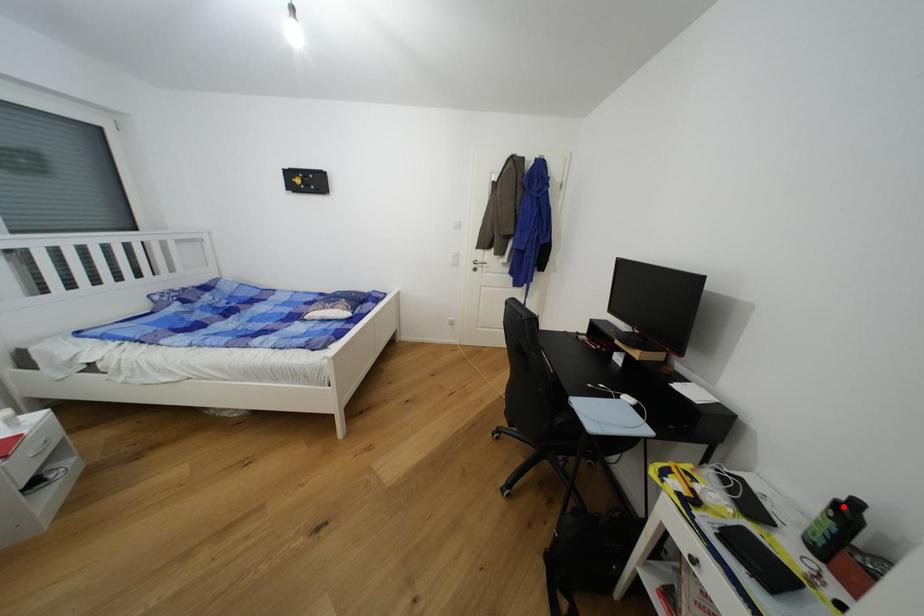
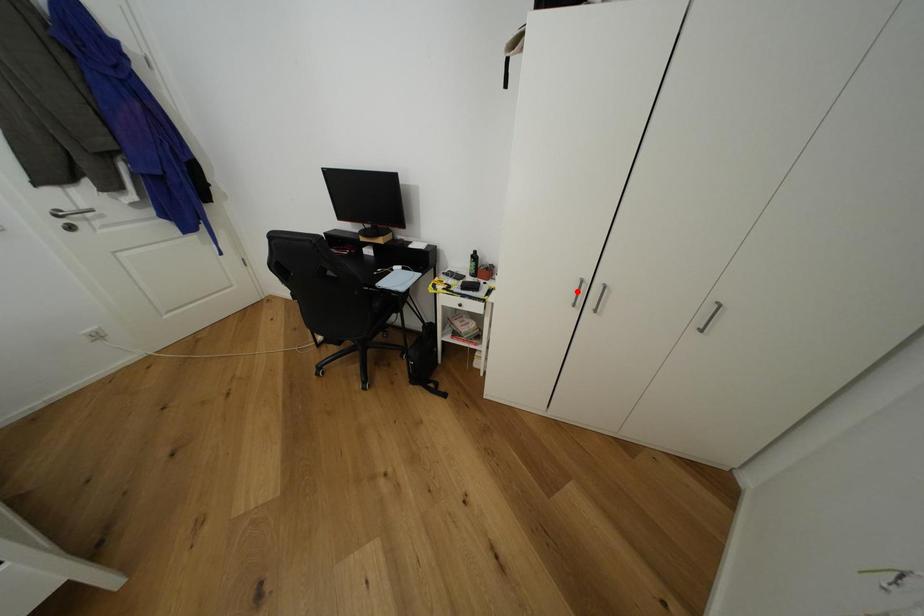
I am providing you with two images of the same scene from different viewpoints. A red point is marked on the first image and another point is marked on the second image. Are the points marked in image1 and image2 representing the same 3D position?

No